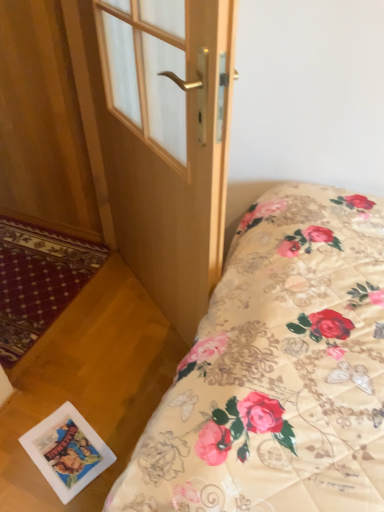
Question: In the image, is wooden door at center positioned in front of or behind white glossy postcard at lower left?

Choices:
 (A) front
 (B) behind

Answer: (A)

Question: Considering the relative positions of wooden door at center and white glossy postcard at lower left in the image provided, is wooden door at center to the left or to the right of white glossy postcard at lower left?

Choices:
 (A) right
 (B) left

Answer: (A)

Question: Does point (97, 41) appear closer or farther from the camera than point (77, 456)?

Choices:
 (A) farther
 (B) closer

Answer: (A)

Question: In the image, is white glossy postcard at lower left on the left side or the right side of wooden door at center?

Choices:
 (A) right
 (B) left

Answer: (B)

Question: From the image's perspective, is white glossy postcard at lower left above or below wooden door at center?

Choices:
 (A) below
 (B) above

Answer: (A)

Question: Looking at their shapes, would you say white glossy postcard at lower left is wider or thinner than wooden door at center?

Choices:
 (A) thin
 (B) wide

Answer: (B)

Question: From a real-world perspective, is white glossy postcard at lower left physically located above or below wooden door at center?

Choices:
 (A) below
 (B) above

Answer: (A)